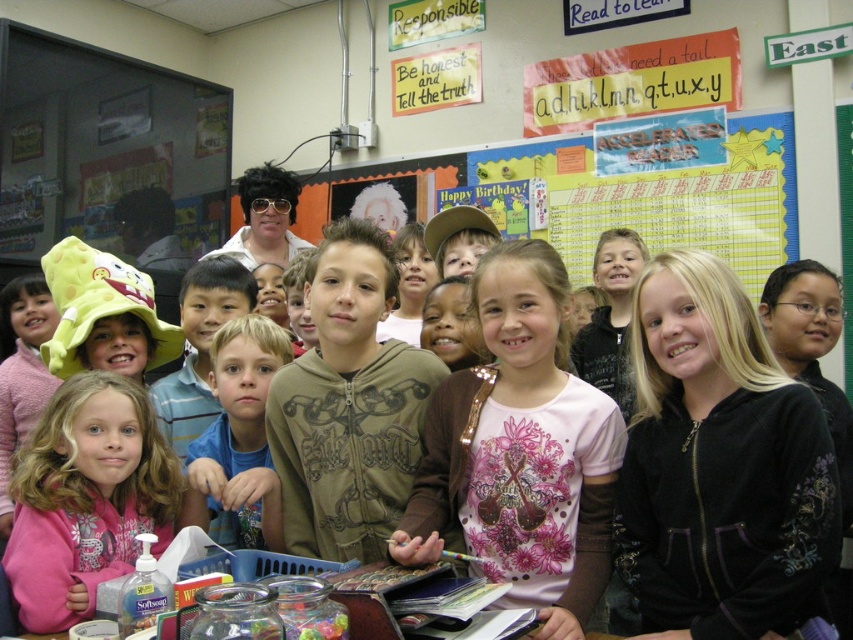
You are a student in the classroom and need to find the pink fleece jacket at lower left. Where should you look relative to the Happy Birthday! poster on the wall?

The pink fleece jacket at lower left is located at point (86, 497), which is to the lower left of the Happy Birthday! poster on the wall.

You are a student in the classroom and you want to borrow a pen from the teacher. You notice the black velvety hoodie at center and the blue cotton shirt at center. Which clothing item is covering the other one?

The black velvety hoodie at center is positioned over blue cotton shirt at center, so it is covering the blue cotton shirt at center.